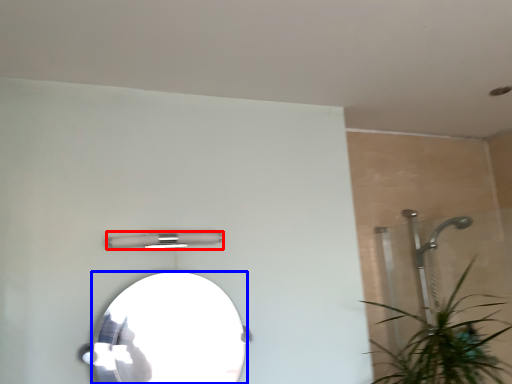
Question: Which point is further to the camera, light fixture (highlighted by a red box) or mirror (highlighted by a blue box)?

Choices:
 (A) light fixture
 (B) mirror

Answer: (A)